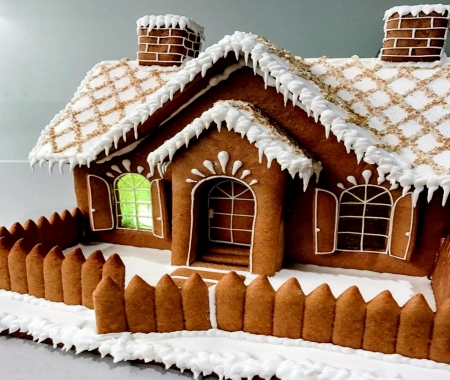
Locate an element on the screen. light on inside house is located at coordinates (143, 198).